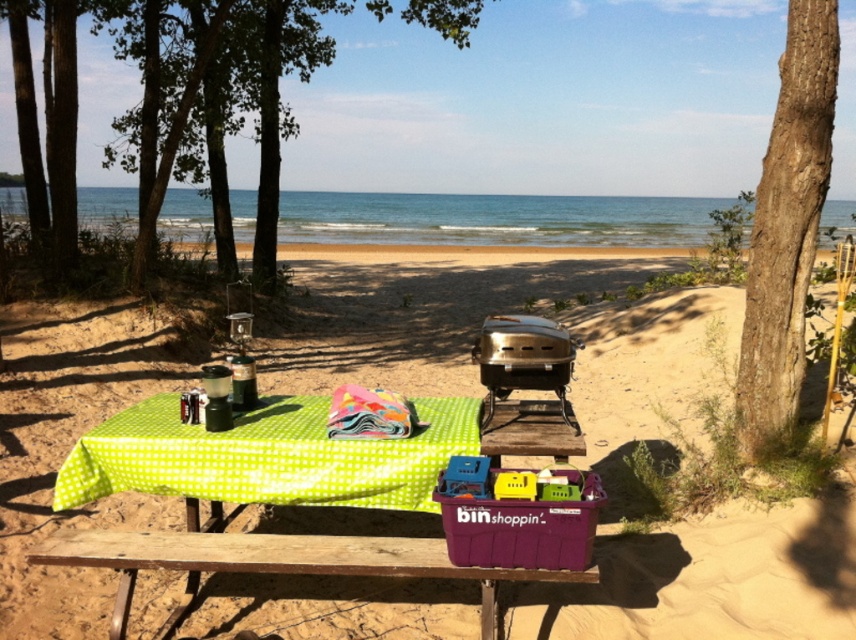
Between point (839, 628) and point (366, 417), which one is positioned in front?

Positioned in front is point (839, 628).

At what (x,y) coordinates should I click in order to perform the action: click on brown sandy beach at center. Please return your answer as a coordinate pair (x, y). Image resolution: width=856 pixels, height=640 pixels. Looking at the image, I should click on (67, 449).

Where is `brown sandy beach at center`? This screenshot has width=856, height=640. brown sandy beach at center is located at coordinates (67, 449).

Between brown sandy beach at center and green checkered picnic table at center, which one appears on the right side from the viewer's perspective?

brown sandy beach at center

Is brown sandy beach at center closer to the viewer compared to green checkered picnic table at center?

No, it is behind green checkered picnic table at center.

Which is behind, point (174, 588) or point (308, 404)?

Point (174, 588)

Identify the location of brown sandy beach at center. This screenshot has width=856, height=640. (67, 449).

Is brown rough bark tree at right smaller than green leafy tree at left?

Yes, brown rough bark tree at right is smaller than green leafy tree at left.

Which of these two, brown rough bark tree at right or green leafy tree at left, stands taller?

green leafy tree at left is taller.

Measure the distance between point (804, 230) and camera.

12.86 feet

This screenshot has width=856, height=640. Identify the location of brown rough bark tree at right. (786, 227).